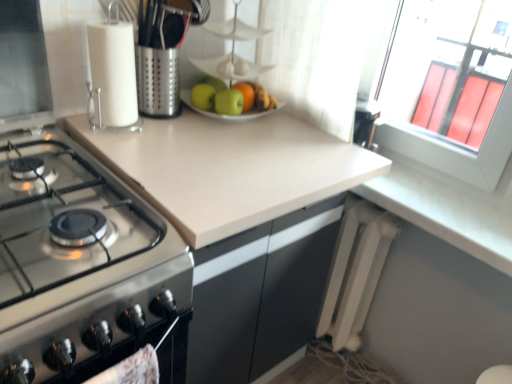
Where is `vacant space to the right of glossy orange at center`? Image resolution: width=512 pixels, height=384 pixels. vacant space to the right of glossy orange at center is located at coordinates (298, 122).